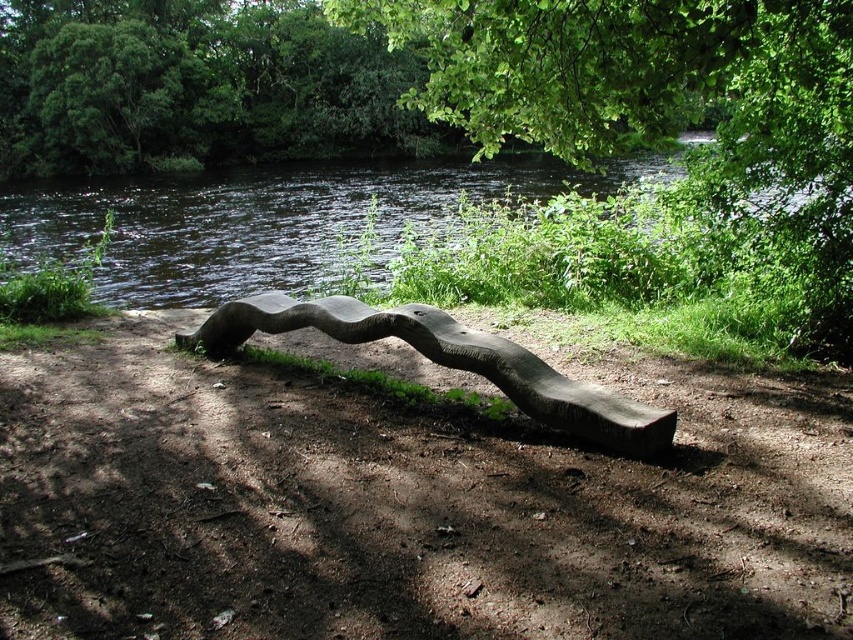
You are standing on the dirt path and want to sit on the dark brown wood bench at center. Which direction should you walk to reach it from the green leafy river at center?

You should walk to the right to reach the dark brown wood bench at center because the green leafy river at center is to the left of the dark brown wood bench at center.

You are standing at the base of the green leafy tree at upper center and want to place a 10 feet long wooden bench that curves gently to the right. Will the bench fit entirely within the dirt path without extending beyond the path on either side?

The bench is 10 feet long, and the distance between the green leafy tree at upper center and the viewer is 12.21 feet. Since the bench is shorter than the distance available, it can fit within the dirt path without extending beyond the path on either side.